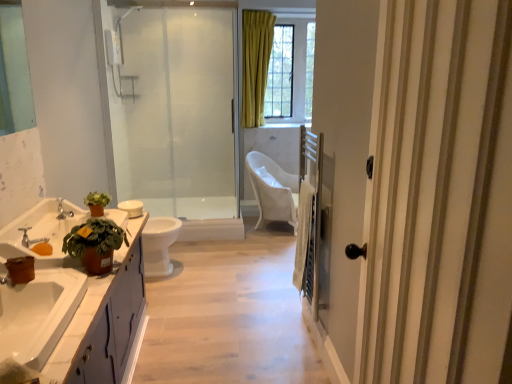
In order to click on free point above wooden balustrade at right (from a real-world perspective) in this screenshot , I will do `click(311, 182)`.